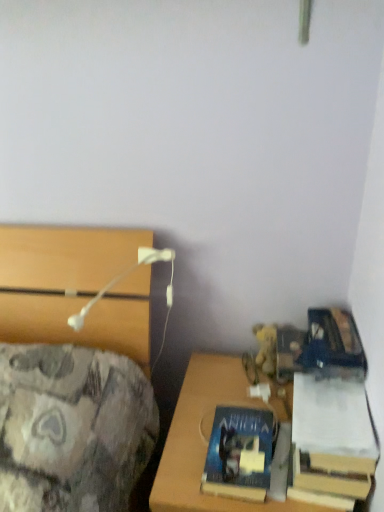
Question: Is hardcover book at lower right, which is the 2th book from left to right, bigger or smaller than yellow plush at right?

Choices:
 (A) big
 (B) small

Answer: (A)

Question: From a real-world perspective, is hardcover book at lower right, which is the 2th book from left to right, above or below yellow plush at right?

Choices:
 (A) below
 (B) above

Answer: (A)

Question: Which object is the closest to the white plastic table lamp at upper left?

Choices:
 (A) hardcover book at lower right, placed as the first book when sorted from right to left
 (B) wooden desk at lower right
 (C) blue matte book at lower right, which ranks as the 2th book in right-to-left order
 (D) yellow plush at right

Answer: (B)

Question: Considering the real-world distances, which object is closest to the blue matte book at lower right, the 1th book when ordered from left to right?

Choices:
 (A) yellow plush at right
 (B) wooden desk at lower right
 (C) white plastic table lamp at upper left
 (D) hardcover book at lower right, which is the 2th book from left to right

Answer: (B)